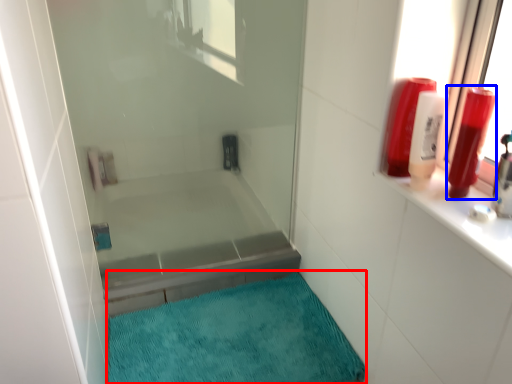
Question: Which object appears closest to the camera in this image, bath mat (highlighted by a red box) or toiletry (highlighted by a blue box)?

Choices:
 (A) bath mat
 (B) toiletry

Answer: (B)